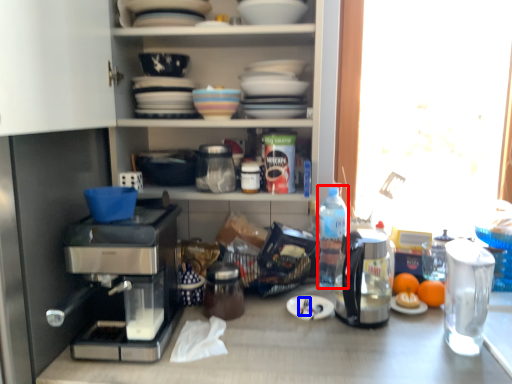
Question: Which of the following is the closest to the observer, bottle (highlighted by a red box) or silverware (highlighted by a blue box)?

Choices:
 (A) bottle
 (B) silverware

Answer: (B)